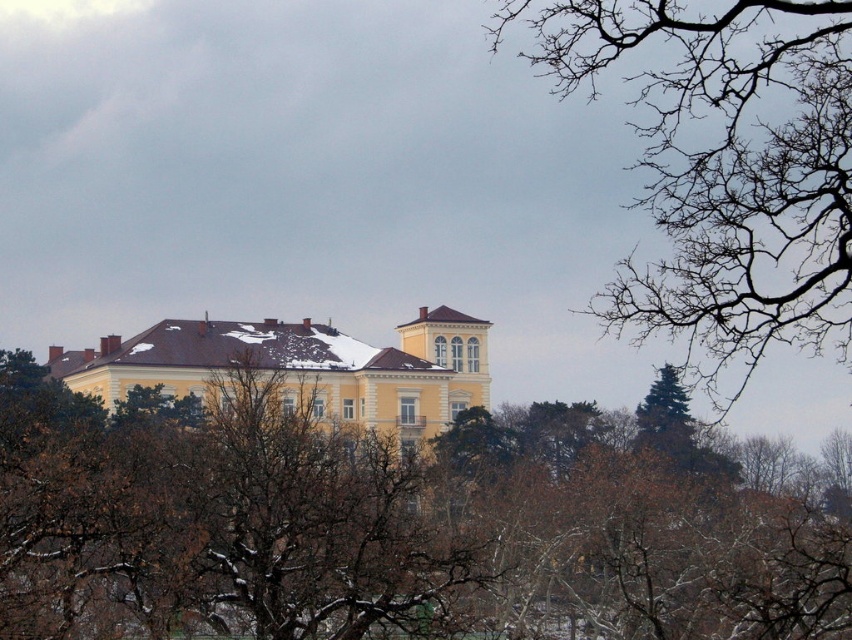
You are an architect analyzing the building surrounded by trees. Which of the two branches, the brown leafless branches at upper center or the bare branches at upper right, has a greater width?

The brown leafless branches at upper center has a greater width than the bare branches at upper right according to the description.

You are standing at the base of the building and looking towards the tower. There are two points marked on the roof, one at point (786,16) and the other at point (108,403). Which point is closer to the edge of the roof?

Point (108,403) is closer to the edge of the roof because it is in front of point (786,16), which is further back on the roof.